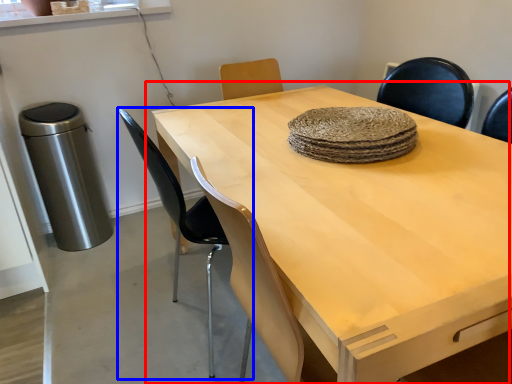
Question: Which point is closer to the camera, table (highlighted by a red box) or chair (highlighted by a blue box)?

Choices:
 (A) table
 (B) chair

Answer: (A)